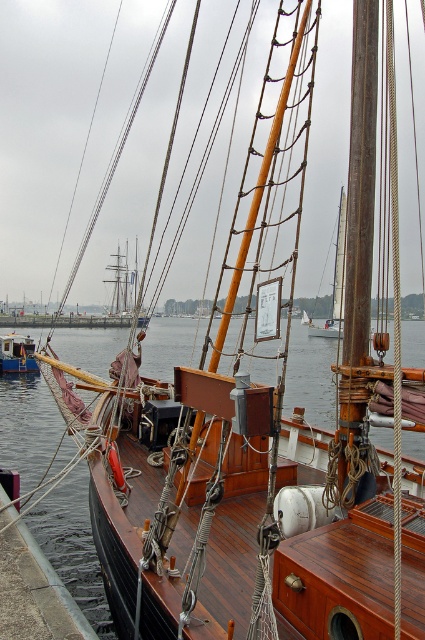
Is point (333, 333) positioned behind point (2, 340)?

That is True.

Measure the distance between wooden mast at center and wooden boat at lower left.

wooden mast at center is 23.19 meters away from wooden boat at lower left.

Locate an element on the screen. wooden mast at center is located at coordinates (336, 280).

Which is more to the left, brown wood deck at lower left or wooden boat at lower left?

wooden boat at lower left

Does brown wood deck at lower left appear under wooden boat at lower left?

Indeed, brown wood deck at lower left is positioned under wooden boat at lower left.

The height and width of the screenshot is (640, 425). What do you see at coordinates (34, 593) in the screenshot?
I see `brown wood deck at lower left` at bounding box center [34, 593].

Where is `brown wood deck at lower left`? brown wood deck at lower left is located at coordinates (34, 593).

Is transparent water at center bigger than wooden boat at lower left?

Correct, transparent water at center is larger in size than wooden boat at lower left.

Is transparent water at center smaller than wooden boat at lower left?

No, transparent water at center is not smaller than wooden boat at lower left.

Who is more distant from viewer, [82,596] or [10,358]?

The point [10,358] is more distant.

Where is `transparent water at center`? transparent water at center is located at coordinates (20, 460).